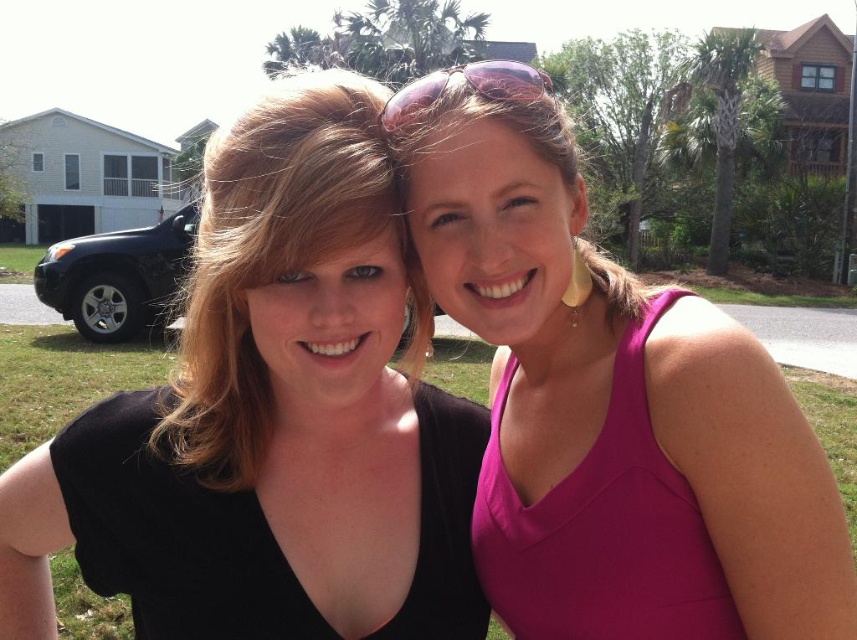
Is black matte tank top at center in front of black matte dress at left?

That is True.

Is point (75, 520) closer to camera compared to point (64, 436)?

That is True.

Image resolution: width=857 pixels, height=640 pixels. I want to click on black matte tank top at center, so click(x=273, y=417).

Can you confirm if black matte tank top at center is positioned to the left of fuchsia fabric tank top at right?

Correct, you'll find black matte tank top at center to the left of fuchsia fabric tank top at right.

Between black matte tank top at center and fuchsia fabric tank top at right, which one is positioned higher?

black matte tank top at center is higher up.

Does point (388, 572) lie behind point (621, 600)?

Yes, it is behind point (621, 600).

I want to click on black matte tank top at center, so click(x=273, y=417).

This screenshot has width=857, height=640. What do you see at coordinates (172, 534) in the screenshot?
I see `black matte dress at left` at bounding box center [172, 534].

Who is taller, black matte dress at left or fuchsia fabric tank top at right?

With more height is fuchsia fabric tank top at right.

You are a GUI agent. You are given a task and a screenshot of the screen. Output one action in this format:
    pyautogui.click(x=<x>, y=<y>)
    Task: Click on the black matte dress at left
    The height and width of the screenshot is (640, 857).
    Given the screenshot: What is the action you would take?
    pyautogui.click(x=172, y=534)